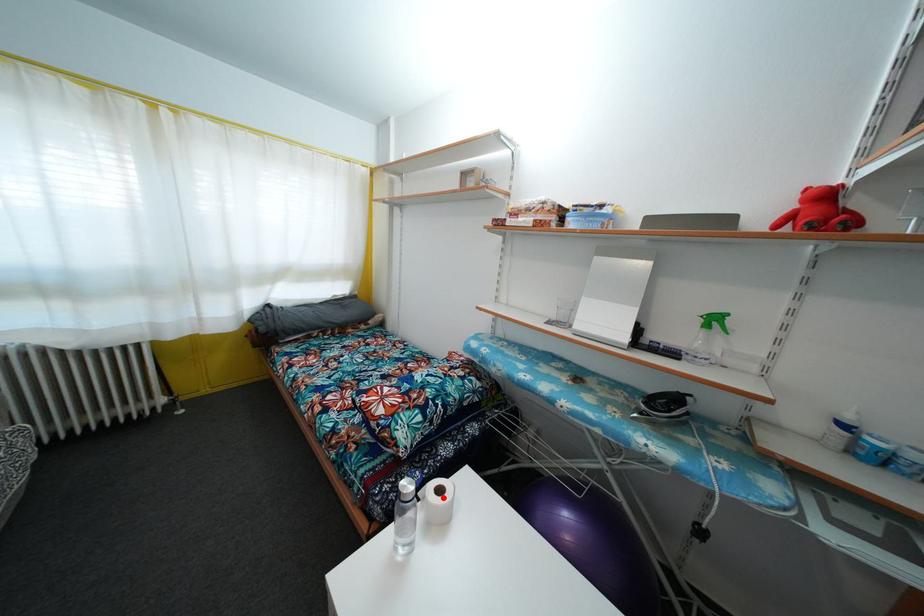
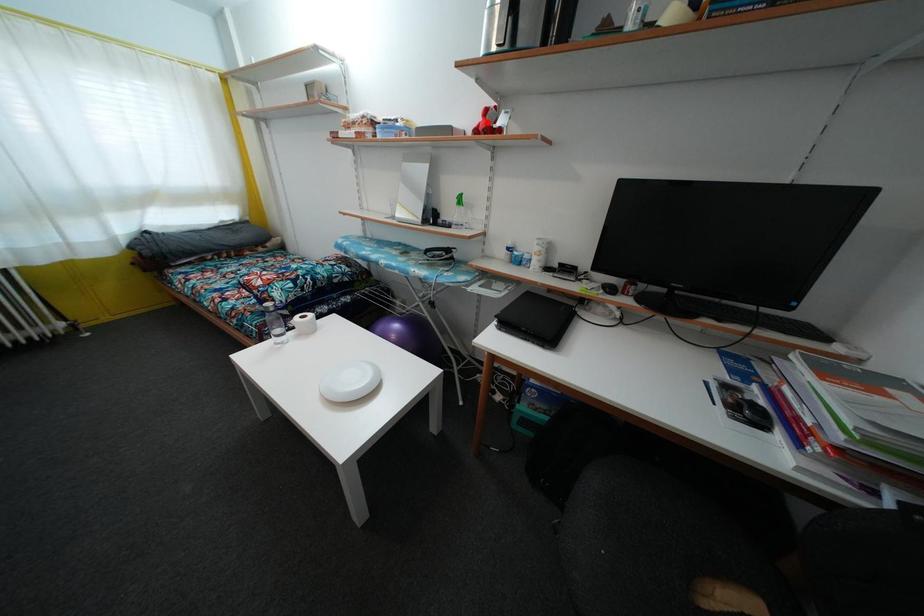
I am providing you with two images of the same scene from different viewpoints. A red point is marked on the first image and another point is marked on the second image. Is the red point in image1 aligned with the point shown in image2?

No